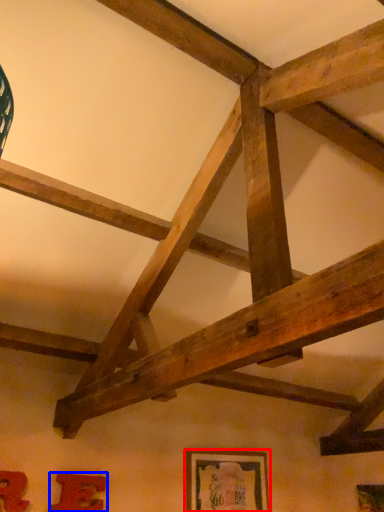
Question: Which point is closer to the camera, picture frame (highlighted by a red box) or picture frame (highlighted by a blue box)?

Choices:
 (A) picture frame
 (B) picture frame

Answer: (B)